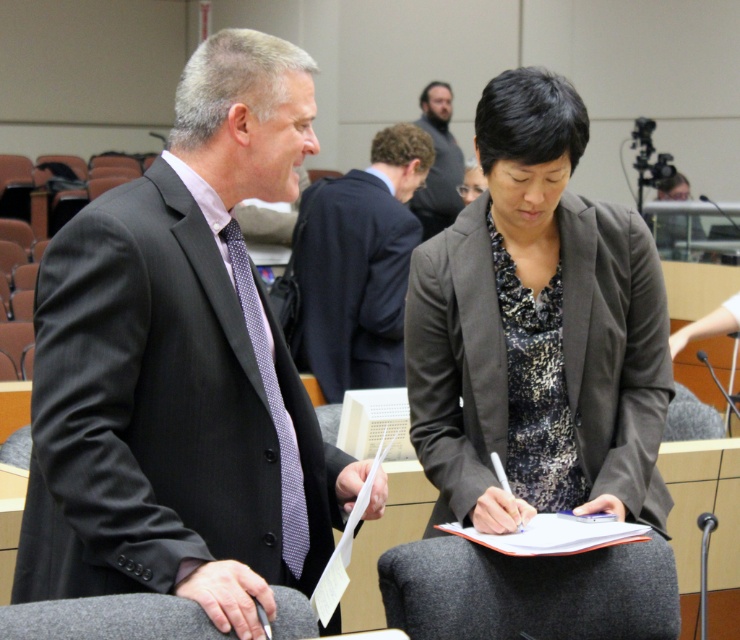
You are standing in the conference room and want to take a photo of the point at coordinates (613, 403). The camera you have can only focus on objects within 7 feet. Will the point be in focus?

The point at coordinates (613, 403) is 7.28 feet from the camera, which is beyond the 7 feet focus range. Therefore, the point will not be in focus.

You are an event planner observing the scene. You need to ensure that the dark brown hair at center and the matte black suit at center are both visible in a photo. Which object should you focus on to capture both in frame?

The dark brown hair at center is bigger than the matte black suit at center, so focusing on the larger dark brown hair at center will help ensure both objects are visible in the photo.

In the conference room scene, you need to determine which object takes up more visual space. You see the dark gray textured blazer at center and the dark brown hair at center. Which one is larger in size?

The dark brown hair at center is larger in size than the dark gray textured blazer at center because the dark gray textured blazer at center occupies less space than dark brown hair at center.